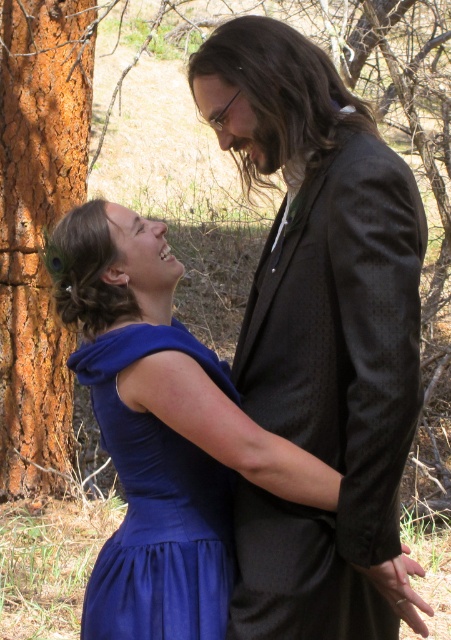
The image size is (451, 640). What do you see at coordinates (38, 225) in the screenshot?
I see `orange rough bark tree at left` at bounding box center [38, 225].

Who is positioned more to the right, orange rough bark tree at left or satin blue dress at center?

satin blue dress at center

Does point (10, 4) come behind point (116, 634)?

Yes, point (10, 4) is behind point (116, 634).

The width and height of the screenshot is (451, 640). Identify the location of orange rough bark tree at left. (38, 225).

The image size is (451, 640). What do you see at coordinates (321, 337) in the screenshot? I see `dark gray textured suit at center` at bounding box center [321, 337].

Who is more forward, [263,584] or [51,124]?

Point [263,584]

The image size is (451, 640). What do you see at coordinates (321, 337) in the screenshot?
I see `dark gray textured suit at center` at bounding box center [321, 337].

This screenshot has width=451, height=640. I want to click on dark gray textured suit at center, so click(321, 337).

Is dark gray textured suit at center wider than satin blue dress at center?

Yes.

Describe the element at coordinates (321, 337) in the screenshot. Image resolution: width=451 pixels, height=640 pixels. I see `dark gray textured suit at center` at that location.

This screenshot has width=451, height=640. Identify the location of dark gray textured suit at center. (321, 337).